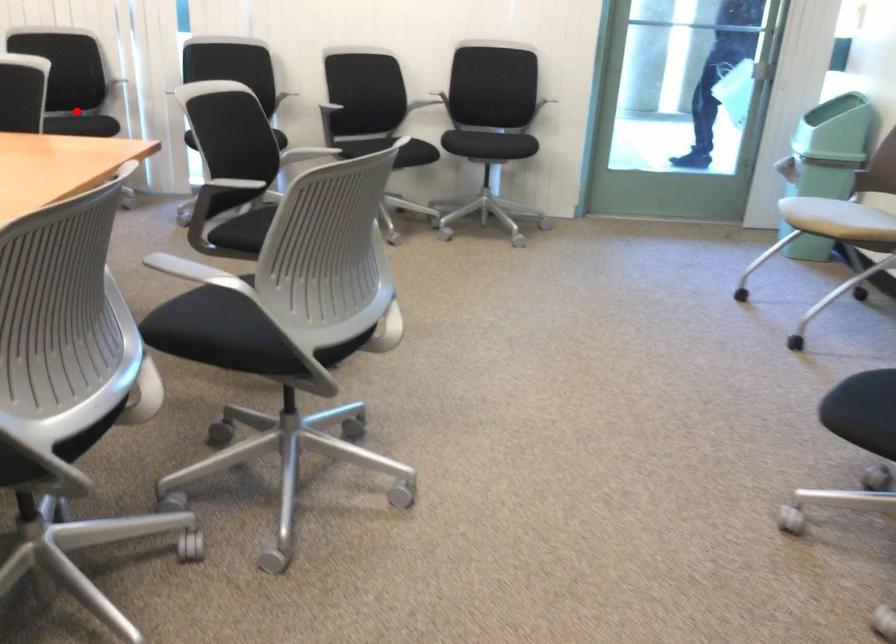
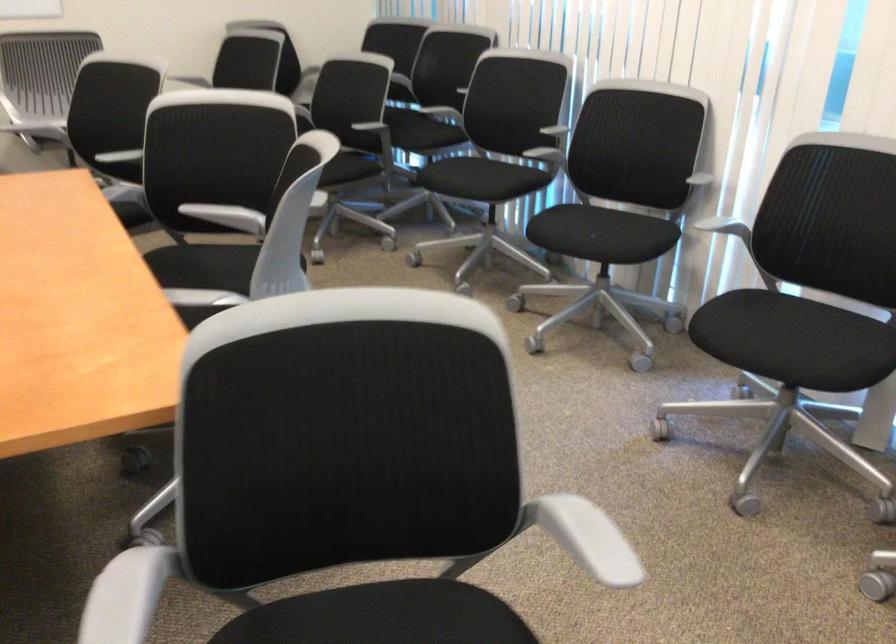
Locate, in the second image, the point that corresponds to the highlighted location in the first image.

(582, 232)